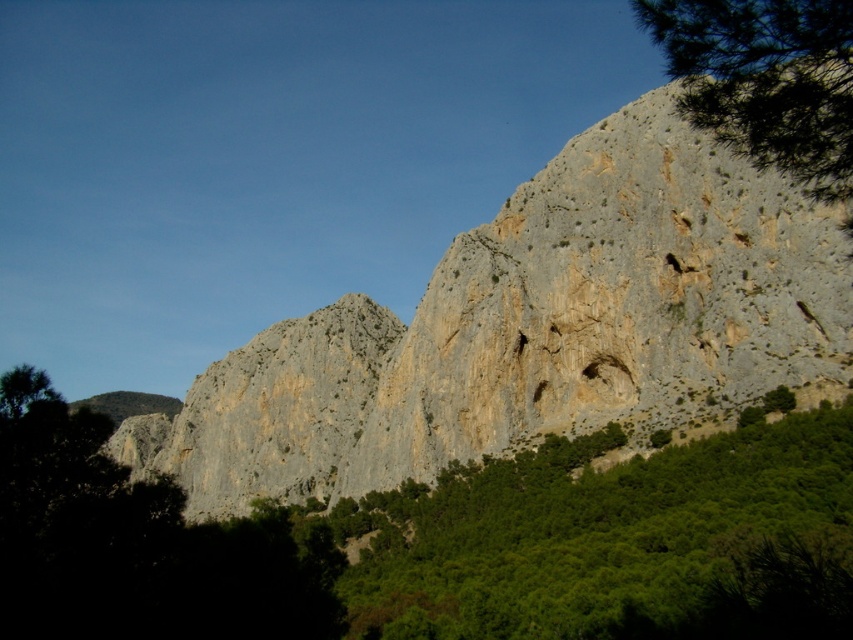
Question: Can you confirm if gray rock formation at center is positioned below green leafy tree at upper right?

Choices:
 (A) no
 (B) yes

Answer: (B)

Question: Does gray rock formation at center appear on the right side of green leafy tree at center?

Choices:
 (A) yes
 (B) no

Answer: (A)

Question: Which point appears farthest from the camera in this image?

Choices:
 (A) (695, 77)
 (B) (757, 227)

Answer: (B)

Question: Which point is closer to the camera?

Choices:
 (A) (657, 384)
 (B) (781, 1)
 (C) (222, 536)

Answer: (B)

Question: Can you confirm if green leafy tree at center is positioned above green leafy tree at upper right?

Choices:
 (A) no
 (B) yes

Answer: (A)

Question: Which point is farther to the camera?

Choices:
 (A) (817, 380)
 (B) (109, 634)

Answer: (A)